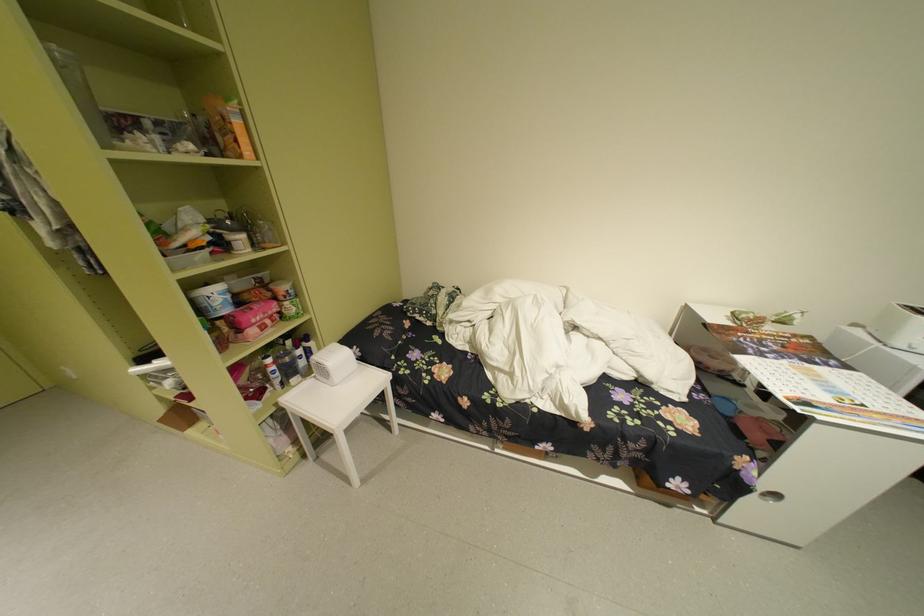
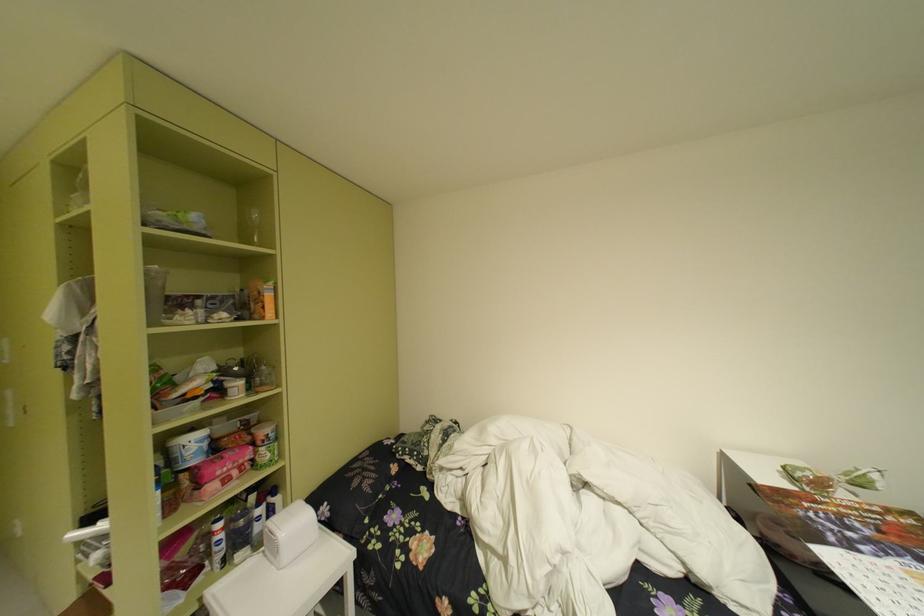
Locate, in the second image, the point that corresponds to (x=285, y=363) in the first image.

(235, 528)